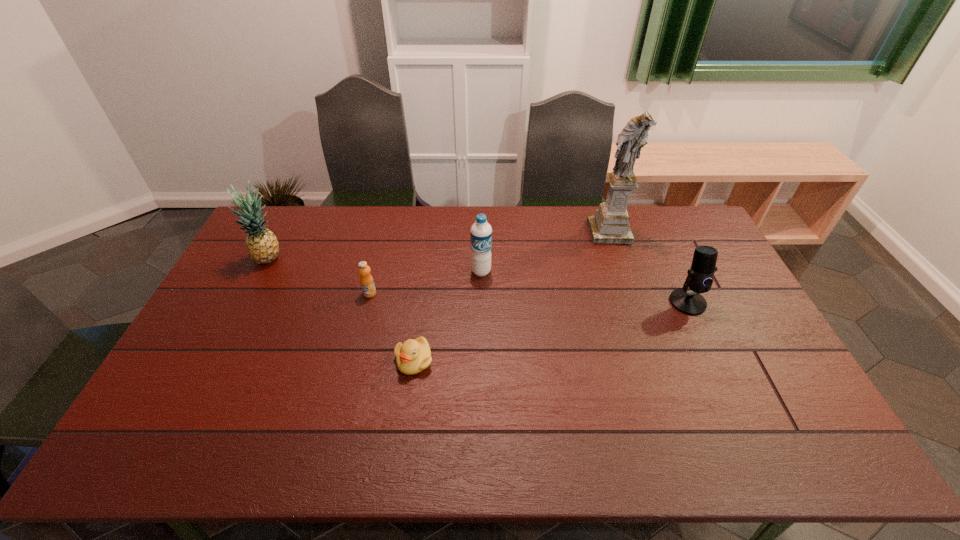
Where is `vacant space located on the front-facing side of the fifth object from left to right`? The width and height of the screenshot is (960, 540). vacant space located on the front-facing side of the fifth object from left to right is located at coordinates (616, 255).

At what (x,y) coordinates should I click in order to perform the action: click on free space located 0.070m on the back of the pineapple. Please return your answer as a coordinate pair (x, y). Looking at the image, I should click on (281, 237).

At what (x,y) coordinates should I click in order to perform the action: click on free space located 0.310m on the label of the water bottle. Please return your answer as a coordinate pair (x, y). Image resolution: width=960 pixels, height=540 pixels. Looking at the image, I should click on (481, 355).

Where is `blank area located on the stand of the rightmost object`? This screenshot has width=960, height=540. blank area located on the stand of the rightmost object is located at coordinates (706, 342).

Where is `vacant space situated on the front label of the orange juice`? This screenshot has height=540, width=960. vacant space situated on the front label of the orange juice is located at coordinates (348, 383).

The height and width of the screenshot is (540, 960). I want to click on vacant area situated 0.120m on the beak of the duckling, so click(x=407, y=418).

This screenshot has width=960, height=540. In order to click on object located in the far edge section of the desktop in this screenshot , I will do `click(610, 225)`.

In order to click on object that is positioned at the left edge in this screenshot , I will do pyautogui.click(x=262, y=245).

In order to click on object present at the right edge in this screenshot , I will do `click(700, 276)`.

I want to click on vacant space at the far edge, so [x=338, y=235].